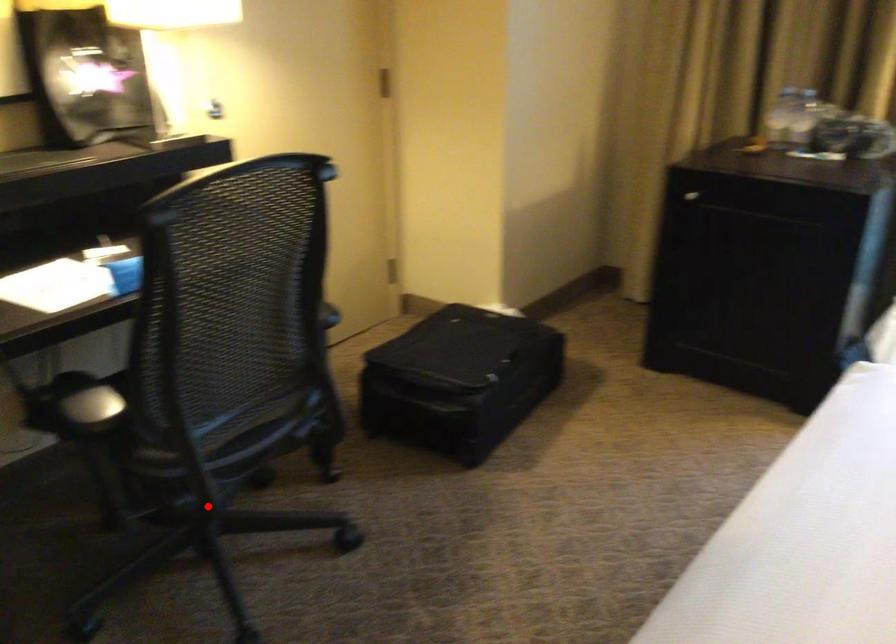
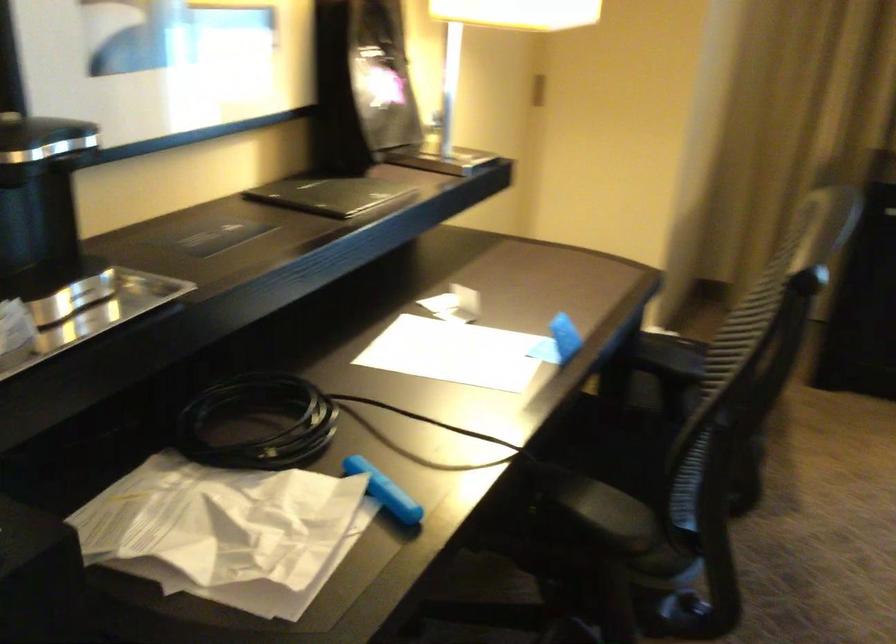
Question: A red point is marked in image1. In image2, is the corresponding 3D point closer to the camera or farther? Reply with the corresponding letter.

Choices:
 (A) The corresponding 3D point is closer.
 (B) The corresponding 3D point is farther.

Answer: (A)